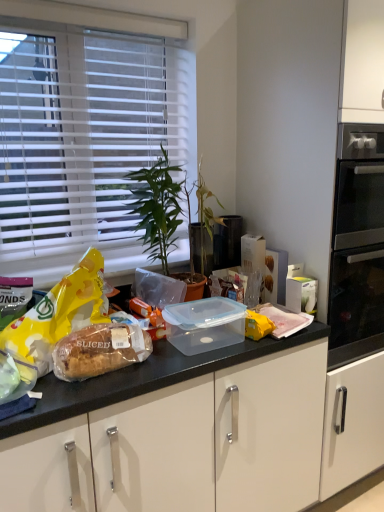
Image resolution: width=384 pixels, height=512 pixels. What are the coordinates of `free space above white plastic blinds at upper left (from a real-world perspective)` in the screenshot? It's located at (91, 9).